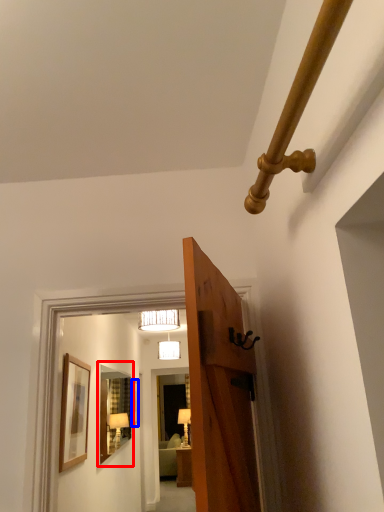
Question: Which object appears closest to the camera in this image, mirror (highlighted by a red box) or picture frame (highlighted by a blue box)?

Choices:
 (A) mirror
 (B) picture frame

Answer: (A)